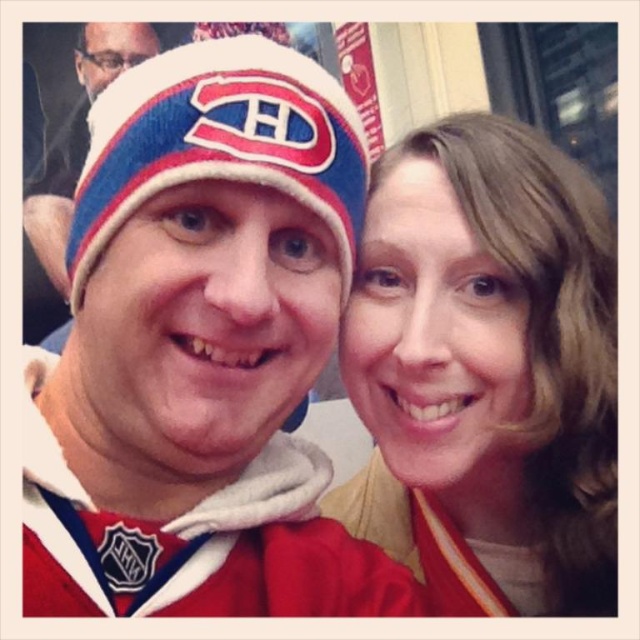
You are taking a photo of two friends in a crowd. You notice two points in the image labeled as point (536, 196) and point (173, 60). Which point is closer to the camera?

Point (173, 60) is closer to the camera because point (536, 196) is behind it.

You are a photographer at the event and want to ensure both the matte yellow sweater at center and the blue knit beanie at center are clearly visible in the photo. Given their sizes, which one might you need to adjust your focus on to capture more detail?

The matte yellow sweater at center has a larger width than the blue knit beanie at center, so you should focus more on the matte yellow sweater at center to capture its details since it takes up more space in the frame.